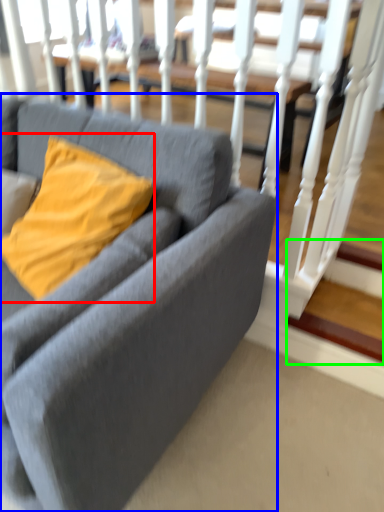
Question: Based on their relative distances, which object is farther from pillow (highlighted by a red box)? Choose from studio couch (highlighted by a blue box) and stairwell (highlighted by a green box).

Choices:
 (A) studio couch
 (B) stairwell

Answer: (B)